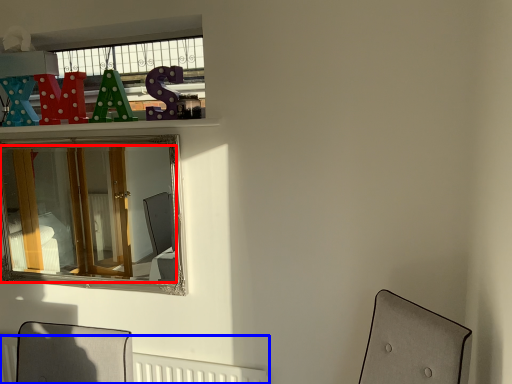
Question: Among these objects, which one is nearest to the camera, mirror (highlighted by a red box) or radiator (highlighted by a blue box)?

Choices:
 (A) mirror
 (B) radiator

Answer: (A)